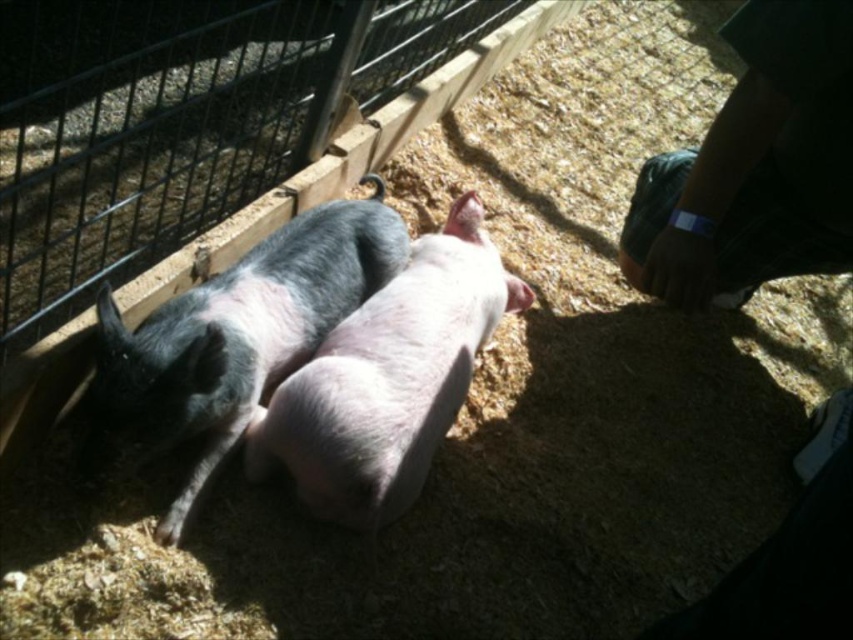
You are a farmer checking the pigs in the enclosure. You need to determine which pig is smaller in width between the gray matte pig at center and the pink smooth pig at center. Which one is it?

The gray matte pig at center has a lesser width compared to the pink smooth pig at center, so the gray matte pig at center is smaller in width.